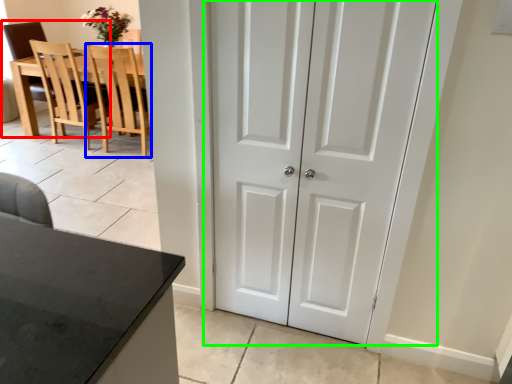
Question: Estimate the real-world distances between objects in this image. Which object is farther from chair (highlighted by a red box), chair (highlighted by a blue box) or door (highlighted by a green box)?

Choices:
 (A) chair
 (B) door

Answer: (B)